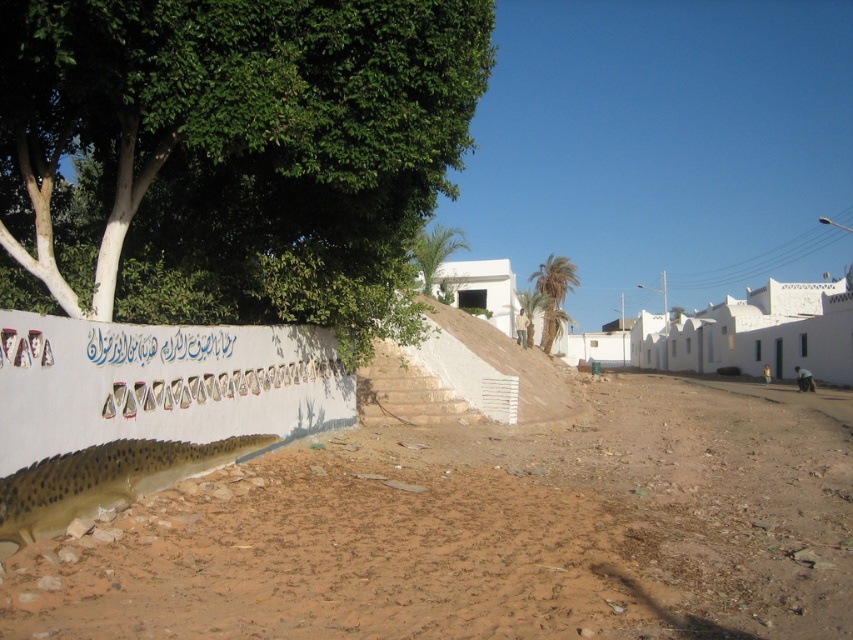
Find the location of a particular element. This screenshot has height=640, width=853. greenish-yellow textured fish at lower left is located at coordinates (102, 481).

Does greenish-yellow textured fish at lower left have a lesser width compared to green leafy palm tree at center?

Correct, greenish-yellow textured fish at lower left's width is less than green leafy palm tree at center's.

Is point (194, 452) less distant than point (537, 304)?

That is True.

You are a GUI agent. You are given a task and a screenshot of the screen. Output one action in this format:
    pyautogui.click(x=<x>, y=<y>)
    Task: Click on the greenish-yellow textured fish at lower left
    The width and height of the screenshot is (853, 640).
    Given the screenshot: What is the action you would take?
    pyautogui.click(x=102, y=481)

Find the location of a particular element. The height and width of the screenshot is (640, 853). green leafy tree at upper left is located at coordinates (231, 156).

Which is above, green leafy tree at upper left or green leafy palm tree at center?

Positioned higher is green leafy tree at upper left.

Does point (160, 29) come behind point (537, 294)?

No, (160, 29) is in front of (537, 294).

Identify the location of green leafy tree at upper left. This screenshot has height=640, width=853. (231, 156).

In the scene shown: Does green leafy palm tree at upper center come in front of green leafy palm tree at center?

Yes, green leafy palm tree at upper center is in front of green leafy palm tree at center.

Can you confirm if green leafy palm tree at upper center is positioned to the right of green leafy palm tree at center?

In fact, green leafy palm tree at upper center is to the left of green leafy palm tree at center.

Which is behind, point (436, 253) or point (527, 333)?

Positioned behind is point (527, 333).

The height and width of the screenshot is (640, 853). I want to click on green leafy palm tree at upper center, so click(x=434, y=250).